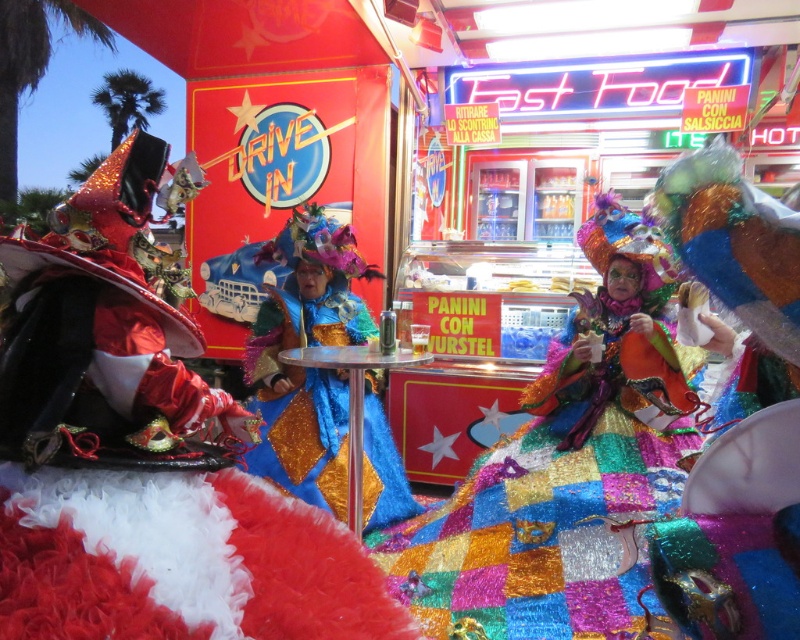
You are a photographer at the drive in and want to take a picture of both the shiny sequined dress at center and the shiny blue fabric dress at center. Which dress should you focus on first if you want to capture them from left to right order?

You should focus on the shiny blue fabric dress at center first because it is positioned to the left of the shiny sequined dress at center.

Consider the image. You are a photographer at the event and want to capture both the shiny red fabric at left and the shiny blue fabric dress at center in a single frame. Which object should you position closer to the left side of your camera viewfinder to ensure both are visible?

To ensure both the shiny red fabric at left and the shiny blue fabric dress at center are visible in the frame, position the shiny red fabric at left closer to the left side of your camera viewfinder since it is already to the left of the shiny blue fabric dress at center.

From the picture: You are standing at the point labeled point (574, 401) and want to reach the entrance of the drive through which is 5 meters away. If you walk straight ahead, will you reach the entrance before walking 5 meters?

The distance between you and the entrance is 5 meters, so yes, walking straight ahead will allow you to reach the entrance before walking 5 meters.